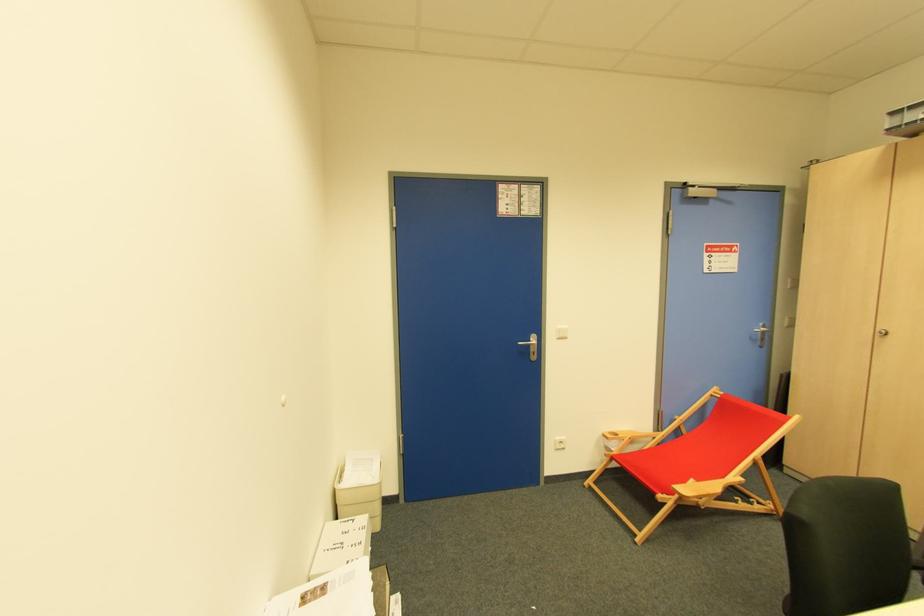
What do you see at coordinates (560, 442) in the screenshot? I see `a white electrical socket` at bounding box center [560, 442].